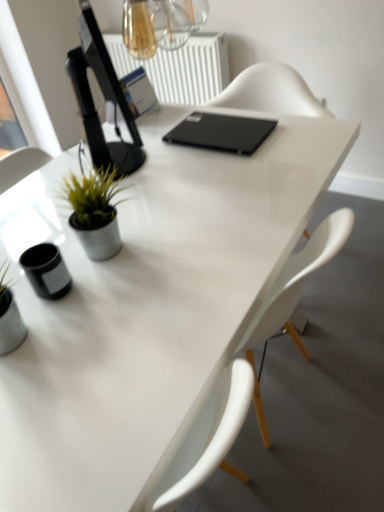
The width and height of the screenshot is (384, 512). I want to click on unoccupied space behind green matte plant at left, so click(113, 201).